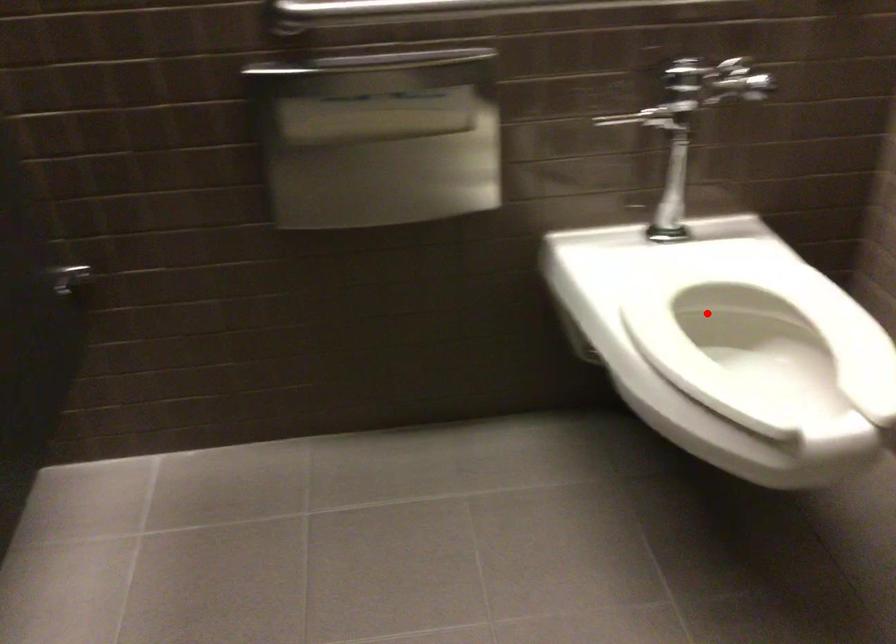
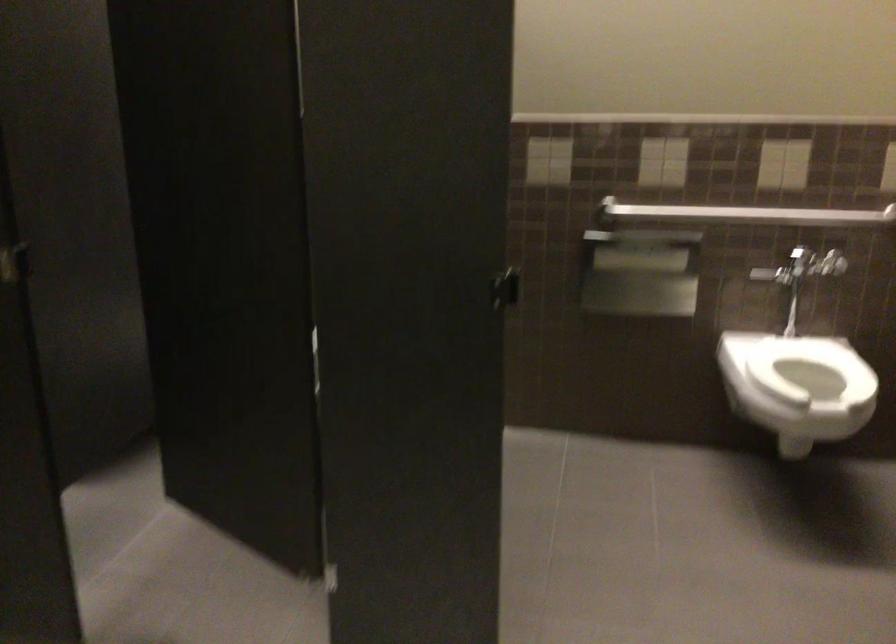
Question: I am providing you with two images of the same scene from different viewpoints. A red point is shown in image1. For the corresponding object point in image2, is it positioned nearer or farther from the camera?

Choices:
 (A) Nearer
 (B) Farther

Answer: (B)